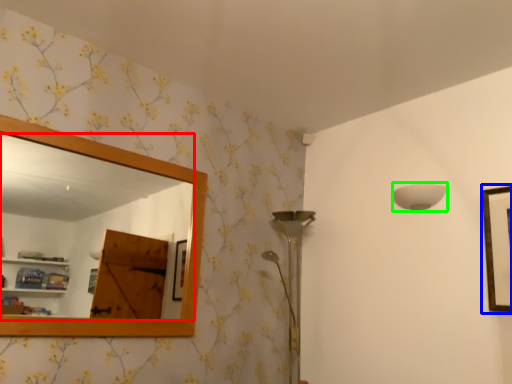
Question: Estimate the real-world distances between objects in this image. Which object is closer to mirror (highlighted by a red box), picture frame (highlighted by a blue box) or lamp (highlighted by a green box)?

Choices:
 (A) picture frame
 (B) lamp

Answer: (B)